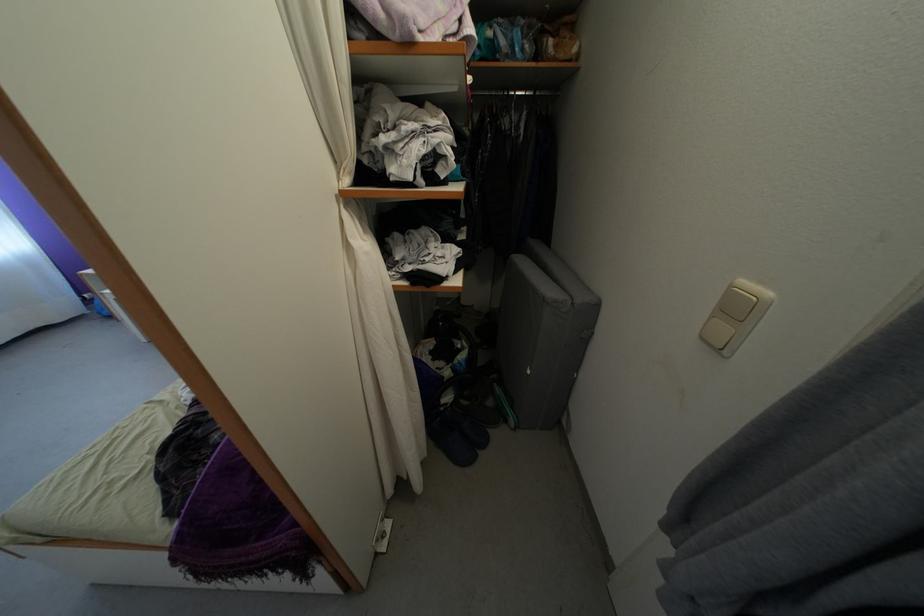
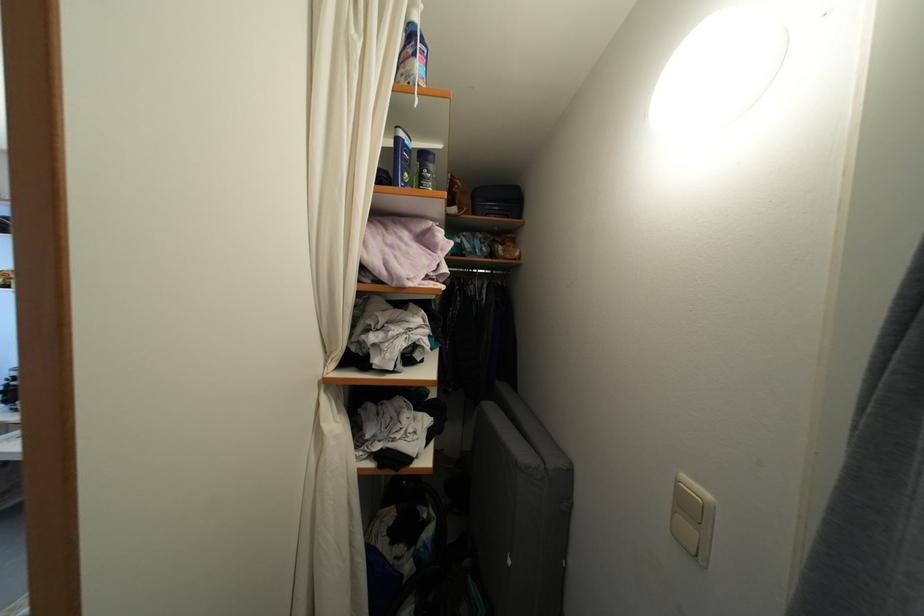
Question: Which direction would the cameraman need to move to produce the second image? Reply with the corresponding letter.

Choices:
 (A) Left
 (B) Right
 (C) Forward
 (D) Backward

Answer: (D)